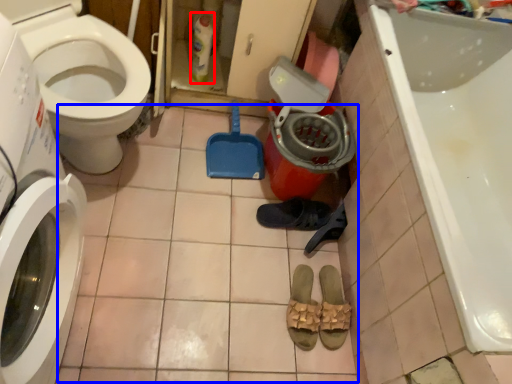
Question: Which of the following is the closest to the observer, cleaning product (highlighted by a red box) or tile (highlighted by a blue box)?

Choices:
 (A) cleaning product
 (B) tile

Answer: (B)